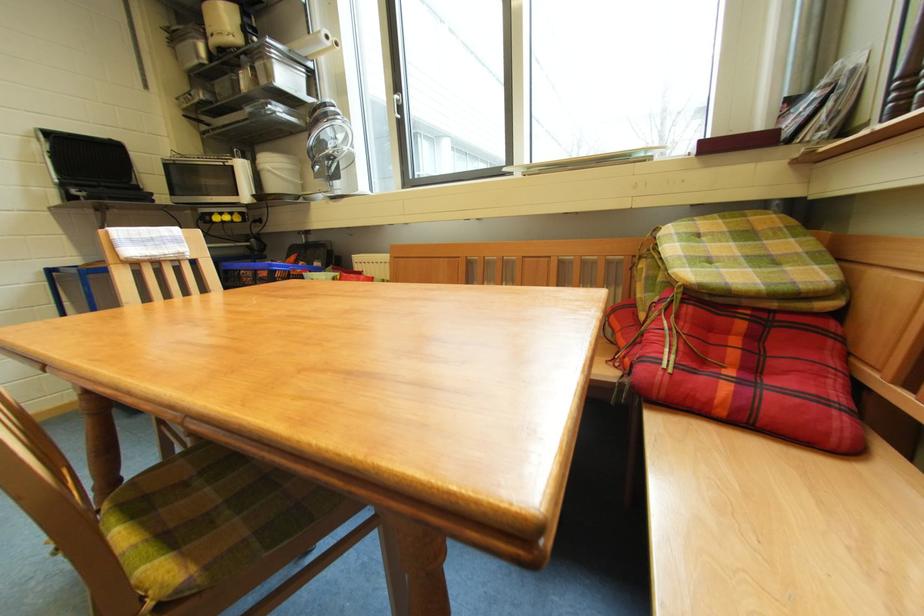
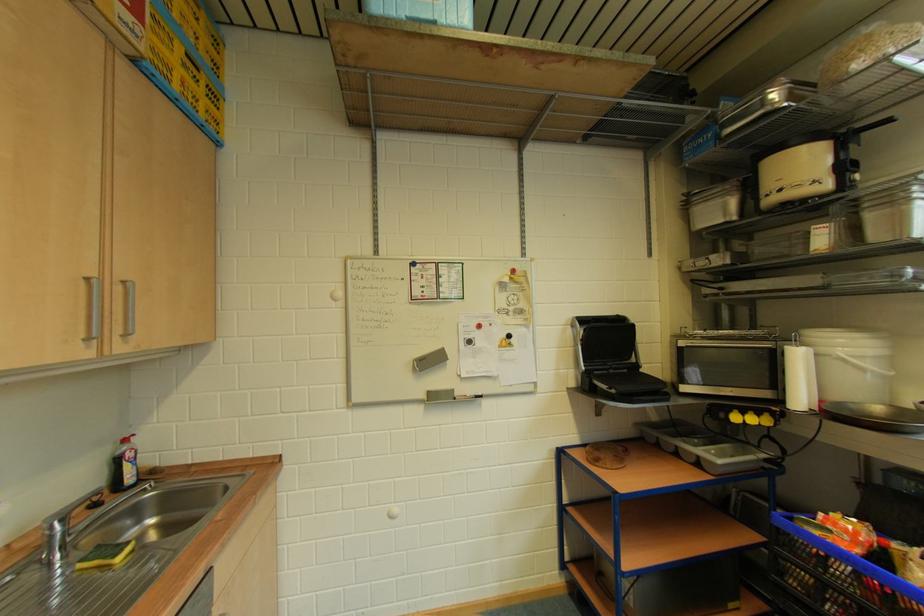
In the second image, find the point that corresponds to [249,169] in the first image.

(805, 359)